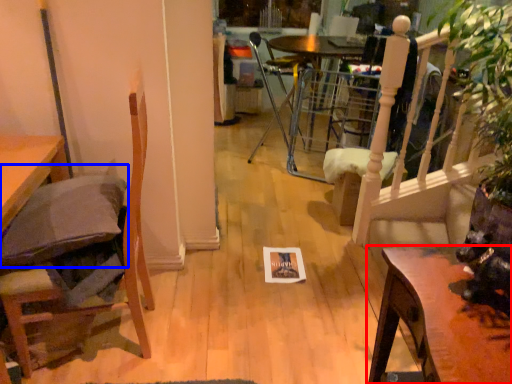
Question: Among these objects, which one is farthest to the camera, table (highlighted by a red box) or pillow (highlighted by a blue box)?

Choices:
 (A) table
 (B) pillow

Answer: (B)